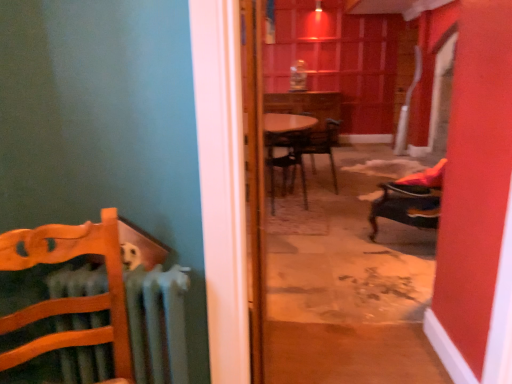
Question: Relative to wooden door at center, is wooden chair at left, placed as the 4th chair when sorted from back to front, in front or behind?

Choices:
 (A) front
 (B) behind

Answer: (A)

Question: From the image's perspective, is wooden chair at left, the 1th chair viewed from the left, located above or below wooden door at center?

Choices:
 (A) below
 (B) above

Answer: (A)

Question: Estimate the real-world distances between objects in this image. Which object is closer to the metallic dark brown chair at center, marked as the third chair in a left-to-right arrangement?

Choices:
 (A) velvet orange chair at right, positioned as the third chair in back-to-front order
 (B) wooden door at center
 (C) wooden chair at left, the 1th chair viewed from the left
 (D) wooden chair at center, placed as the 3th chair when sorted from front to back

Answer: (D)

Question: Estimate the real-world distances between objects in this image. Which object is closer to the velvet orange chair at right, which ranks as the first chair in right-to-left order?

Choices:
 (A) wooden chair at center, placed as the 3th chair when sorted from front to back
 (B) wooden chair at left, placed as the 4th chair when sorted from back to front
 (C) wooden door at center
 (D) metallic dark brown chair at center, which is counted as the second chair, starting from the right

Answer: (A)